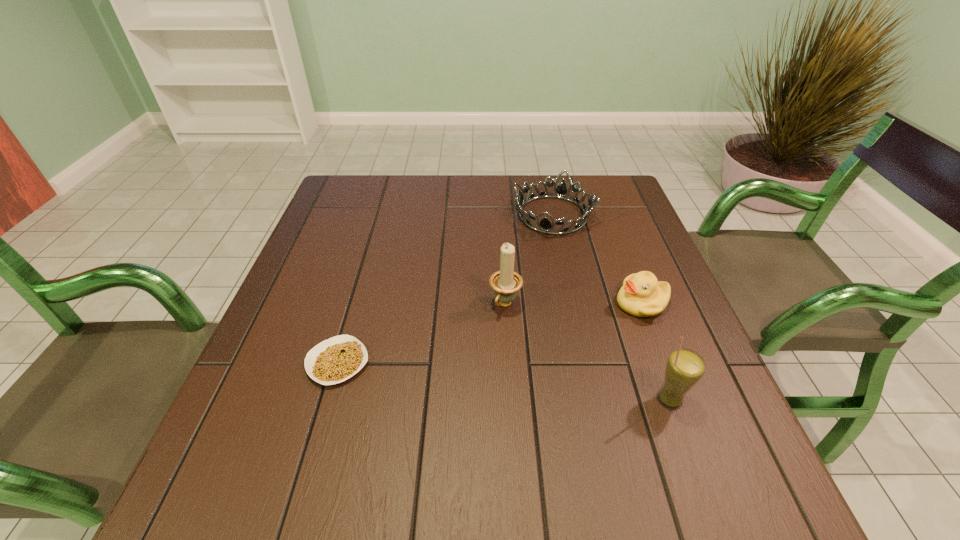
Locate an element on the screen. Image resolution: width=960 pixels, height=540 pixels. the shortest object is located at coordinates (334, 360).

Locate an element on the screen. The width and height of the screenshot is (960, 540). the leftmost object is located at coordinates (334, 360).

Identify the location of straw for drinking. This screenshot has width=960, height=540. (685, 367).

Find the location of a particular element. duckling is located at coordinates (642, 295).

Locate an element on the screen. the second object from left to right is located at coordinates (505, 282).

Image resolution: width=960 pixels, height=540 pixels. In order to click on the farthest object in this screenshot , I will do `click(545, 225)`.

Locate an element on the screen. This screenshot has height=540, width=960. free location located on the right of the legume is located at coordinates (474, 362).

I want to click on free space located on the back of the straw for drinking, so click(x=621, y=268).

Find the location of a particular element. This screenshot has height=540, width=960. free location located 0.050m at the face of the duckling is located at coordinates (606, 321).

Where is `vacant space located at the face of the duckling`? Image resolution: width=960 pixels, height=540 pixels. vacant space located at the face of the duckling is located at coordinates (554, 347).